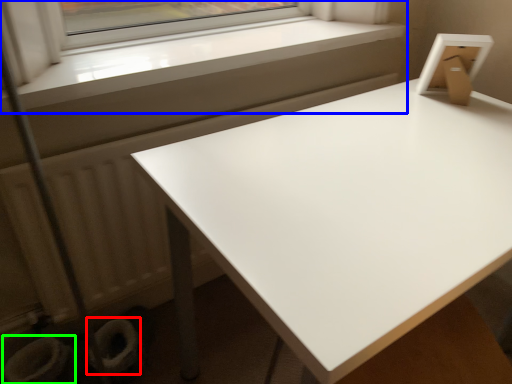
Question: Considering the real-world distances, which object is farthest from toilet bowl (highlighted by a red box)? window (highlighted by a blue box) or toilet bowl (highlighted by a green box)?

Choices:
 (A) window
 (B) toilet bowl

Answer: (A)